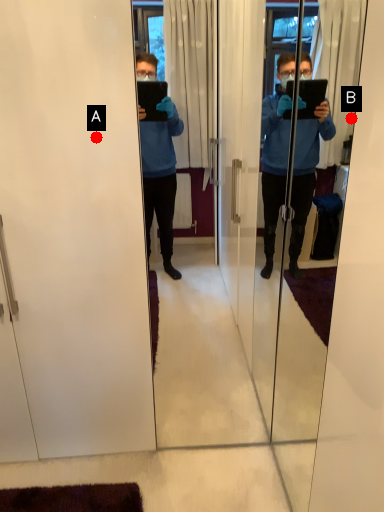
Question: Two points are circled on the image, labeled by A and B beside each circle. Which point appears farthest from the camera in this image?

Choices:
 (A) A is further
 (B) B is further

Answer: (B)